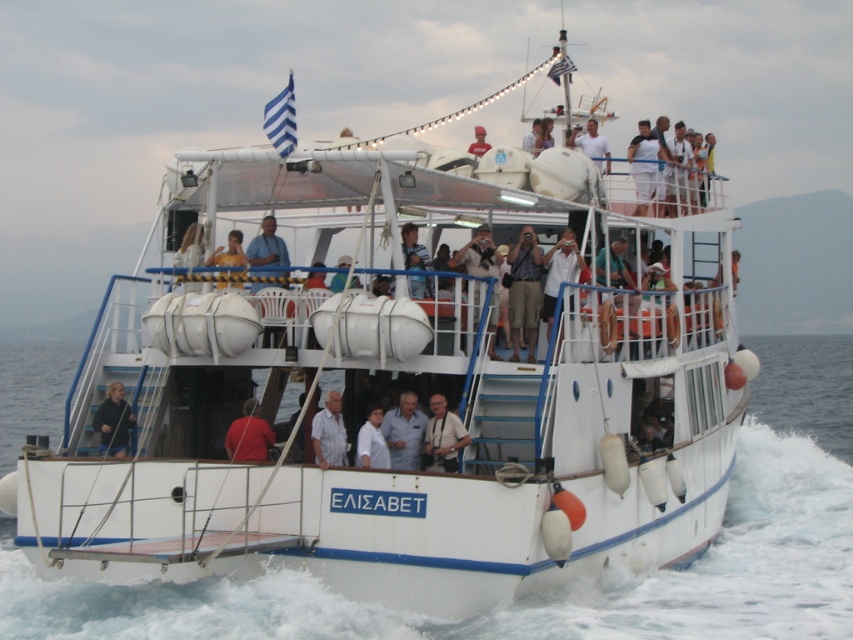
Question: Can you confirm if dark blue fabric jacket at center is smaller than white matte shirt at center?

Choices:
 (A) yes
 (B) no

Answer: (B)

Question: Which object appears closest to the camera in this image?

Choices:
 (A) white water at lower center
 (B) red matte shirt at center
 (C) dark blue fabric jacket at center
 (D) matte white shirt at center

Answer: (A)

Question: Does white striped shirt at center appear on the right side of light brown wooden chair at upper center?

Choices:
 (A) yes
 (B) no

Answer: (A)

Question: Estimate the real-world distances between objects in this image. Which object is farther from the light brown wooden chair at upper center?

Choices:
 (A) white water at lower center
 (B) white striped shirt at center

Answer: (A)

Question: Can you confirm if blue shirt at center is smaller than light brown wooden chair at upper center?

Choices:
 (A) yes
 (B) no

Answer: (B)

Question: Based on their relative distances, which object is nearer to the light brown wooden chair at upper center?

Choices:
 (A) light brown leather jacket at center
 (B) blue shirt at center

Answer: (B)